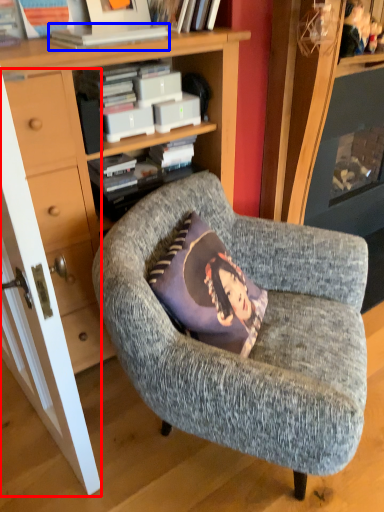
Question: Which object appears farthest to the camera in this image, door (highlighted by a red box) or book (highlighted by a blue box)?

Choices:
 (A) door
 (B) book

Answer: (B)